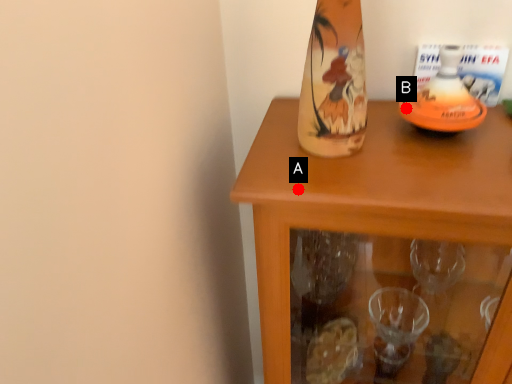
Question: Two points are circled on the image, labeled by A and B beside each circle. Which of the following is the farthest from the observer?

Choices:
 (A) A is further
 (B) B is further

Answer: (B)